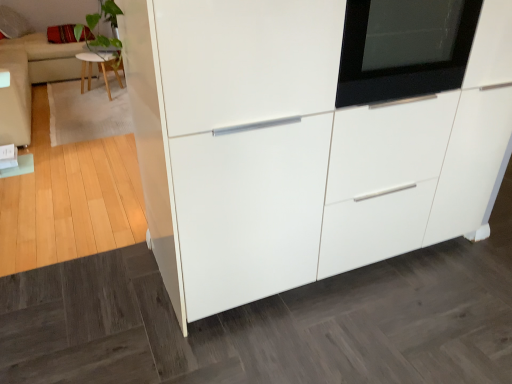
Question: Is black glass oven at upper right wider than velvet red pillow at upper left?

Choices:
 (A) no
 (B) yes

Answer: (A)

Question: Can you confirm if black glass oven at upper right is smaller than velvet red pillow at upper left?

Choices:
 (A) yes
 (B) no

Answer: (A)

Question: Is black glass oven at upper right thinner than velvet red pillow at upper left?

Choices:
 (A) yes
 (B) no

Answer: (A)

Question: From the image's perspective, does black glass oven at upper right appear lower than velvet red pillow at upper left?

Choices:
 (A) yes
 (B) no

Answer: (A)

Question: Can you confirm if black glass oven at upper right is taller than velvet red pillow at upper left?

Choices:
 (A) no
 (B) yes

Answer: (B)

Question: In terms of height, does beige fabric couch at left, acting as the 2th couch starting from the top, look taller or shorter compared to velvet red pillow at upper left?

Choices:
 (A) short
 (B) tall

Answer: (B)

Question: Considering their positions, is beige fabric couch at left, which is counted as the 1th couch, starting from the bottom, located in front of or behind velvet red pillow at upper left?

Choices:
 (A) behind
 (B) front

Answer: (B)

Question: From the image's perspective, is beige fabric couch at left, the 2th couch positioned from the back, above or below velvet red pillow at upper left?

Choices:
 (A) above
 (B) below

Answer: (B)

Question: Is beige fabric couch at left, acting as the first couch starting from the right, wider or thinner than velvet red pillow at upper left?

Choices:
 (A) thin
 (B) wide

Answer: (A)

Question: In terms of width, does light wood stool at upper left look wider or thinner when compared to velvet red pillow at upper left?

Choices:
 (A) wide
 (B) thin

Answer: (B)

Question: Is light wood stool at upper left bigger or smaller than velvet red pillow at upper left?

Choices:
 (A) small
 (B) big

Answer: (B)

Question: Considering the positions of point (117, 77) and point (70, 33), is point (117, 77) closer or farther from the camera than point (70, 33)?

Choices:
 (A) farther
 (B) closer

Answer: (A)

Question: Which is correct: light wood stool at upper left is inside velvet red pillow at upper left, or outside of it?

Choices:
 (A) inside
 (B) outside

Answer: (B)

Question: Based on their sizes in the image, would you say black glass oven at upper right is bigger or smaller than beige fabric couch at upper left, the 2th couch when ordered from bottom to top?

Choices:
 (A) small
 (B) big

Answer: (A)

Question: Looking at their shapes, would you say black glass oven at upper right is wider or thinner than beige fabric couch at upper left, the 2th couch when ordered from bottom to top?

Choices:
 (A) wide
 (B) thin

Answer: (B)